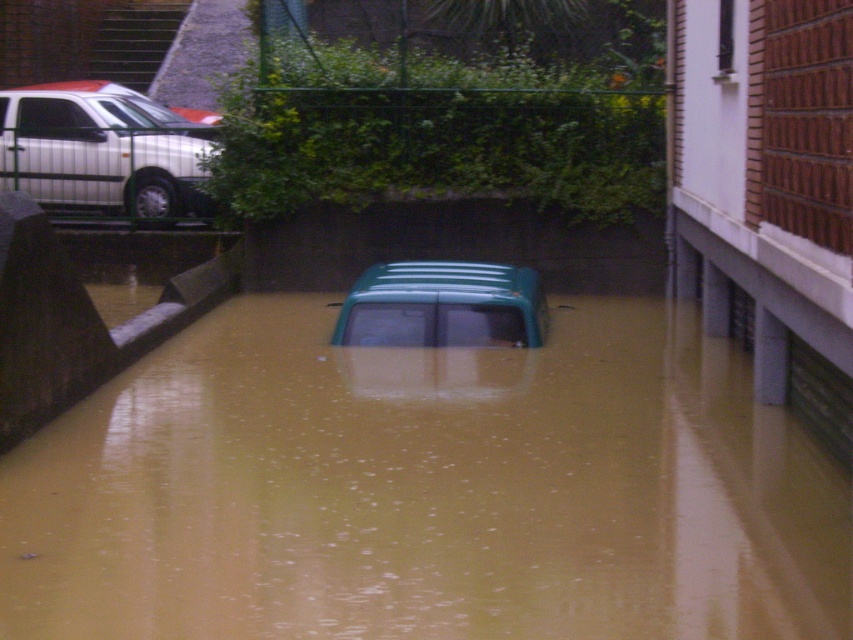
Is brown murky water at center thinner than green matte van at center?

Correct, brown murky water at center's width is less than green matte van at center's.

Which is more to the right, brown murky water at center or green matte van at center?

green matte van at center

From the picture: Who is more forward, (817, 561) or (453, 288)?

Positioned in front is point (817, 561).

The image size is (853, 640). I want to click on brown murky water at center, so pos(425,490).

Which is more to the right, brown murky water at center or silver metallic van at upper left?

brown murky water at center

Does brown murky water at center appear on the right side of silver metallic van at upper left?

Correct, you'll find brown murky water at center to the right of silver metallic van at upper left.

Image resolution: width=853 pixels, height=640 pixels. What do you see at coordinates (425, 490) in the screenshot?
I see `brown murky water at center` at bounding box center [425, 490].

Where is `brown murky water at center`? This screenshot has width=853, height=640. brown murky water at center is located at coordinates (425, 490).

Who is more distant from viewer, (120, 116) or (395, 266)?

Point (120, 116)

Is point (194, 212) more distant than point (508, 346)?

That is True.

Find the location of a particular element. The width and height of the screenshot is (853, 640). silver metallic van at upper left is located at coordinates (97, 154).